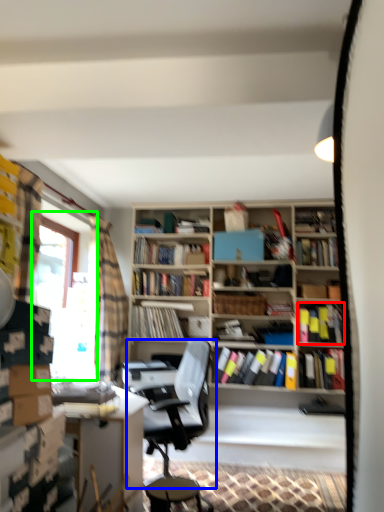
Question: Estimate the real-world distances between objects in this image. Which object is farther from book (highlighted by a red box), chair (highlighted by a blue box) or window screen (highlighted by a green box)?

Choices:
 (A) chair
 (B) window screen

Answer: (B)